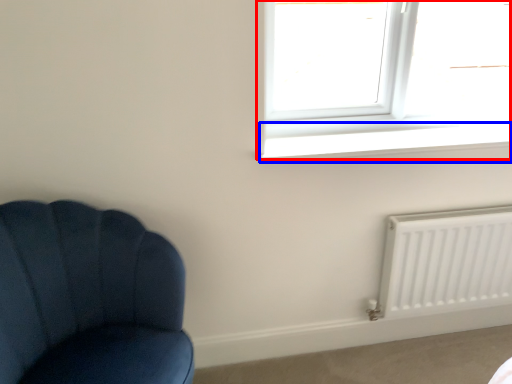
Question: Which object appears farthest to the camera in this image, window (highlighted by a red box) or window sill (highlighted by a blue box)?

Choices:
 (A) window
 (B) window sill

Answer: (A)